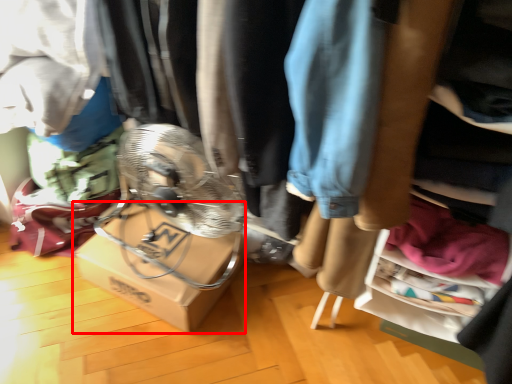
Question: From the image's perspective, what is the correct spatial positioning of cardboard box (annotated by the red box) in reference to clothing?

Choices:
 (A) above
 (B) below

Answer: (B)